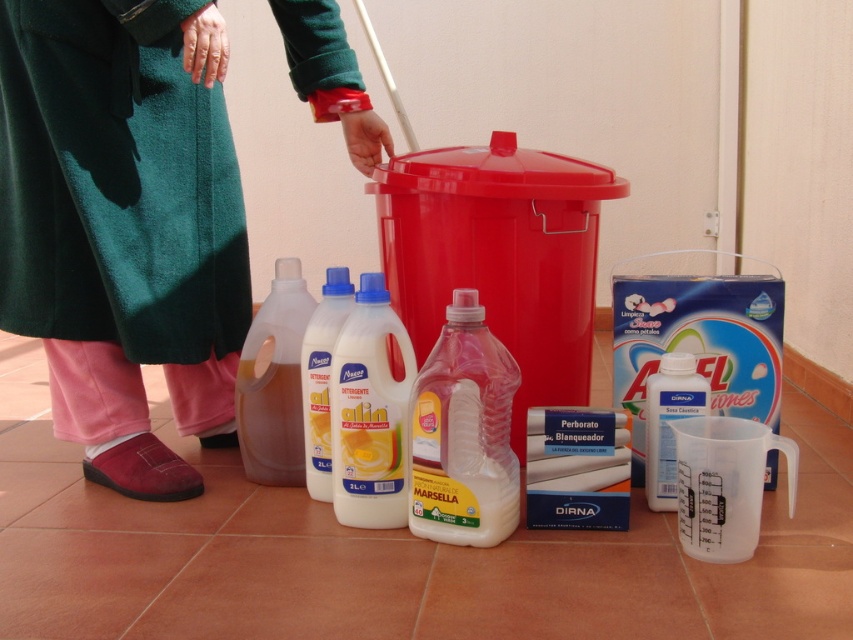
You need to choose a bottle to pour into a narrow sink drain. Which bottle between the white plastic bottle at center and the transparent plastic bottle at lower right is more suitable based on their heights?

The white plastic bottle at center is taller than the transparent plastic bottle at lower right, so it might be more suitable for pouring into a narrow sink drain as its height could allow better control during the pouring process.

You need to wipe a spill using the items in the scene. Which object would be more suitable for the task between the green towel at left and the translucent plastic bottle at lower left?

The green towel at left is more suitable for wiping a spill because it has a larger size compared to the translucent plastic bottle at lower left, making it more effective for cleaning purposes.

You are organizing cleaning supplies in the room. You need to place the white plastic bottle at center and the translucent plastic bottle at lower left on a shelf. Which bottle should you place first if you want to arrange them from narrowest to widest?

The white plastic bottle at center has a lesser width compared to the translucent plastic bottle at lower left, so you should place the white plastic bottle at center first to arrange them from narrowest to widest.